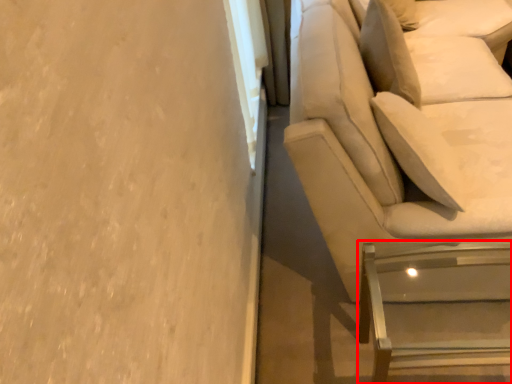
Question: From the image's perspective, what is the correct spatial relationship of furniture (annotated by the red box) in relation to studio couch?

Choices:
 (A) below
 (B) above

Answer: (A)